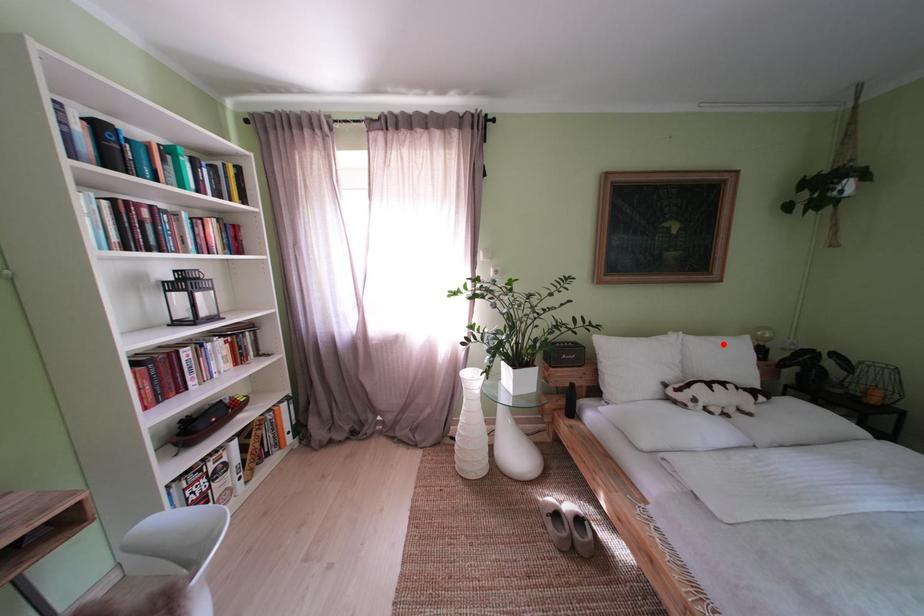
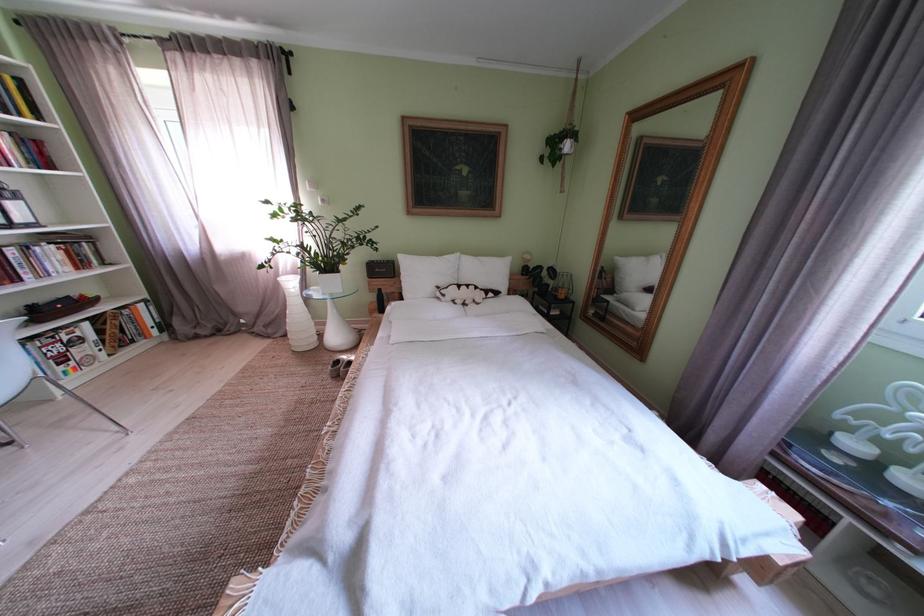
Question: A red point is marked in image1. In image2, is the corresponding 3D point closer to the camera or farther? Reply with the corresponding letter.

Choices:
 (A) The corresponding 3D point is closer.
 (B) The corresponding 3D point is farther.

Answer: (A)